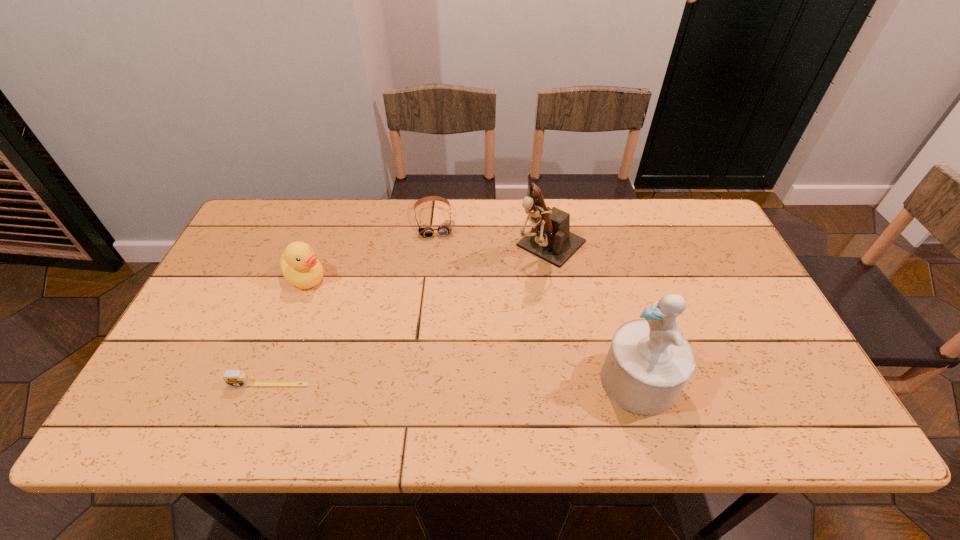
Where is `vacant area situated 0.130m at the beak of the duck`? vacant area situated 0.130m at the beak of the duck is located at coordinates (345, 313).

Find the location of a particular element. vacant space situated 0.290m on the front-facing side of the farther figurine is located at coordinates click(x=466, y=330).

You are a GUI agent. You are given a task and a screenshot of the screen. Output one action in this format:
    pyautogui.click(x=<x>, y=<y>)
    Task: Click on the free location located 0.110m on the front-facing side of the farther figurine
    This screenshot has height=540, width=960.
    Given the screenshot: What is the action you would take?
    pyautogui.click(x=508, y=290)

At what (x,y) coordinates should I click in order to perform the action: click on blank space located on the front-facing side of the farther figurine. Please return your answer as a coordinate pair (x, y). The image size is (960, 540). Looking at the image, I should click on (504, 294).

Identify the location of vacant space located 0.090m on the front-facing side of the third object from left to right. (440, 258).

Where is `free space located on the front-facing side of the third object from left to right`? The height and width of the screenshot is (540, 960). free space located on the front-facing side of the third object from left to right is located at coordinates (444, 290).

Locate an element on the screen. The height and width of the screenshot is (540, 960). free space located 0.280m on the front-facing side of the third object from left to right is located at coordinates (446, 307).

The width and height of the screenshot is (960, 540). Find the location of `figurine positioned at the far edge`. figurine positioned at the far edge is located at coordinates (550, 238).

Find the location of a particular element. The width and height of the screenshot is (960, 540). goggles that is at the far edge is located at coordinates (446, 227).

I want to click on tape measure at the near edge, so click(x=233, y=378).